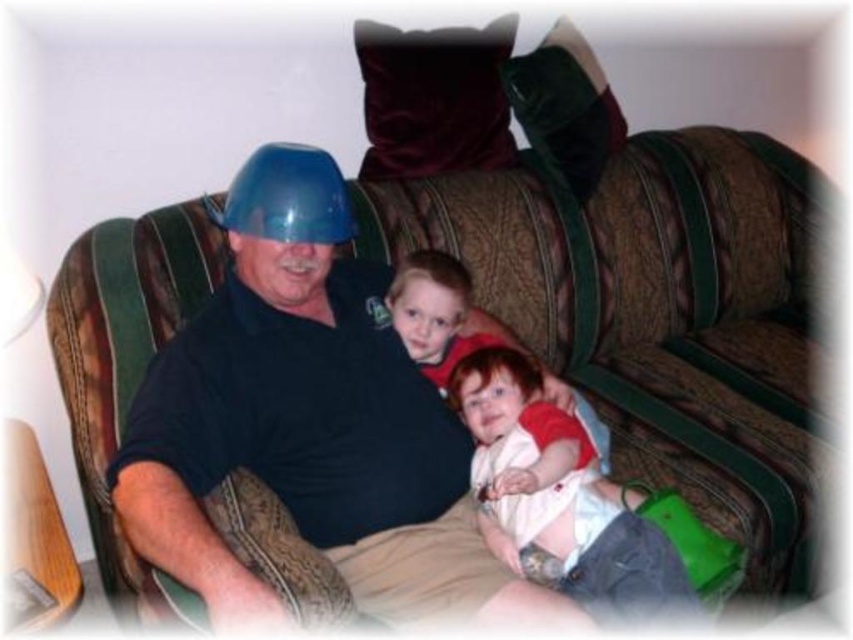
Looking at this image, between brown fabric couch at center and blue plastic helmet at center, which one has more height?

brown fabric couch at center

Is brown fabric couch at center to the left of blue plastic helmet at center from the viewer's perspective?

Incorrect, brown fabric couch at center is not on the left side of blue plastic helmet at center.

Find the location of a particular element. The height and width of the screenshot is (640, 853). brown fabric couch at center is located at coordinates (656, 310).

Identify the location of brown fabric couch at center. This screenshot has width=853, height=640. (656, 310).

Which is more to the left, white cotton shirt at center or blue plastic helmet at center?

Positioned to the left is blue plastic helmet at center.

How far apart are white cotton shirt at center and blue plastic helmet at center?

white cotton shirt at center is 19.71 inches away from blue plastic helmet at center.

Does point (517, 371) come farther from viewer compared to point (283, 196)?

Yes, point (517, 371) is farther from viewer.

This screenshot has width=853, height=640. I want to click on white cotton shirt at center, so [x=556, y=493].

Can you confirm if brown fabric couch at center is shorter than white cotton shirt at center?

No, brown fabric couch at center is not shorter than white cotton shirt at center.

Can you confirm if brown fabric couch at center is positioned to the right of white cotton shirt at center?

Indeed, brown fabric couch at center is positioned on the right side of white cotton shirt at center.

Where is `brown fabric couch at center`? brown fabric couch at center is located at coordinates (656, 310).